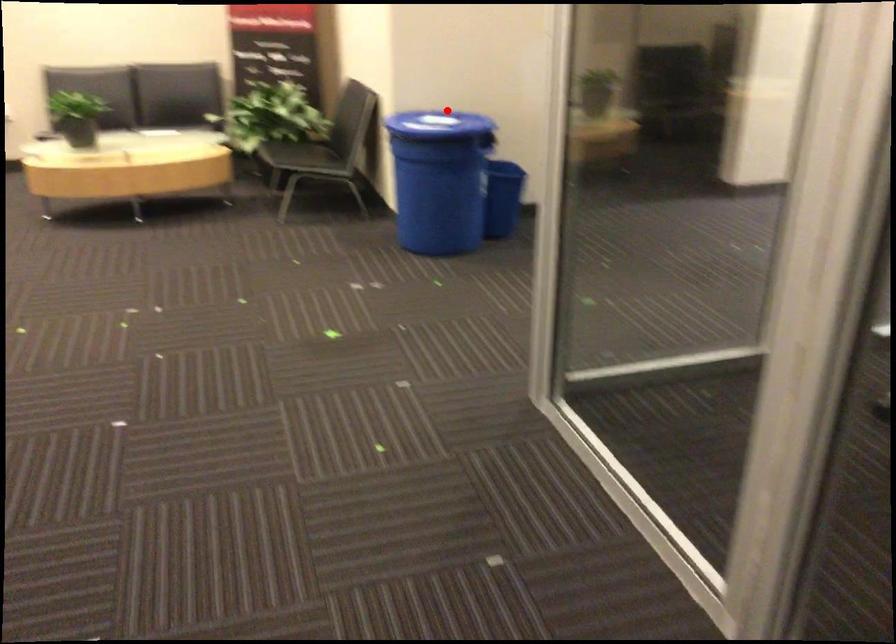
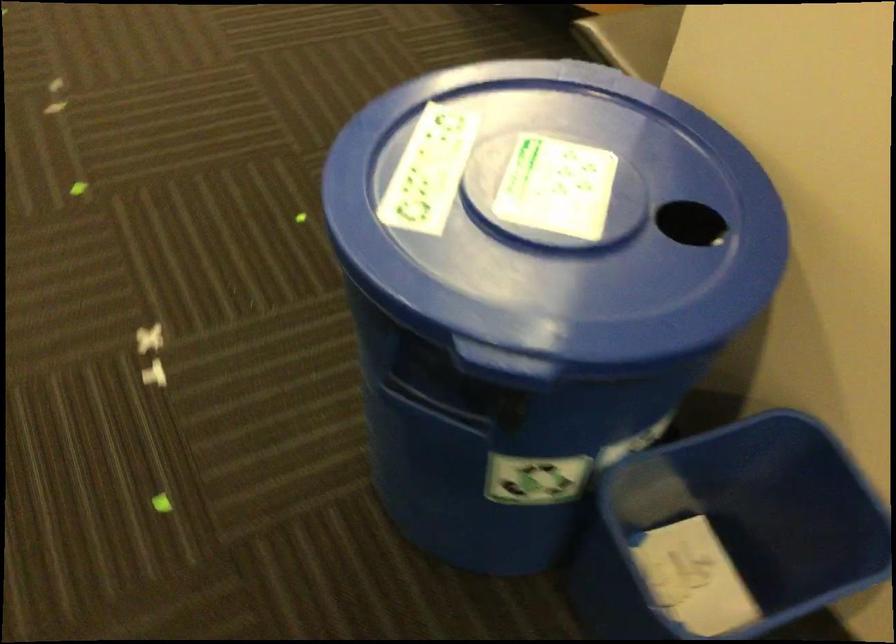
Question: A red point is marked in image1. In image2, is the corresponding 3D point closer to the camera or farther? Reply with the corresponding letter.

Choices:
 (A) The corresponding 3D point is closer.
 (B) The corresponding 3D point is farther.

Answer: (A)